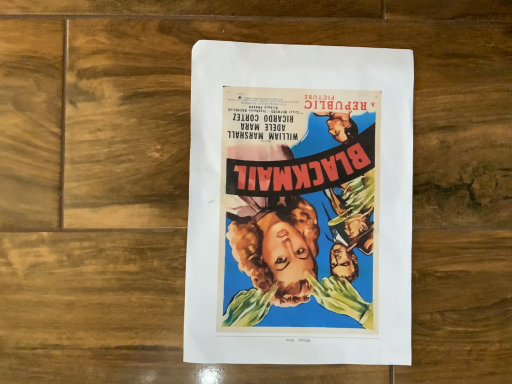
This screenshot has height=384, width=512. What are the coordinates of `vacant space situated above vibrant paper poster at center (from a real-world perspective)` in the screenshot? It's located at (306, 197).